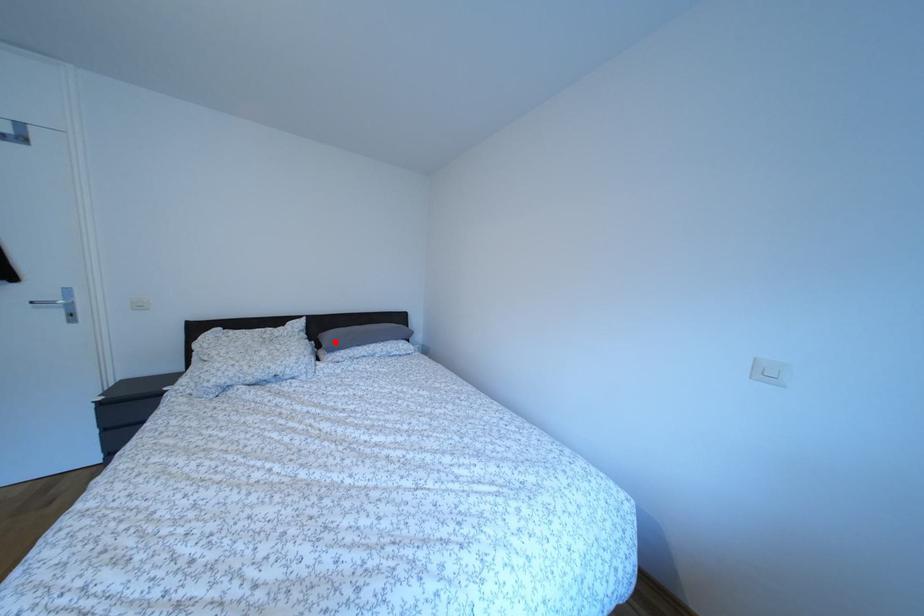
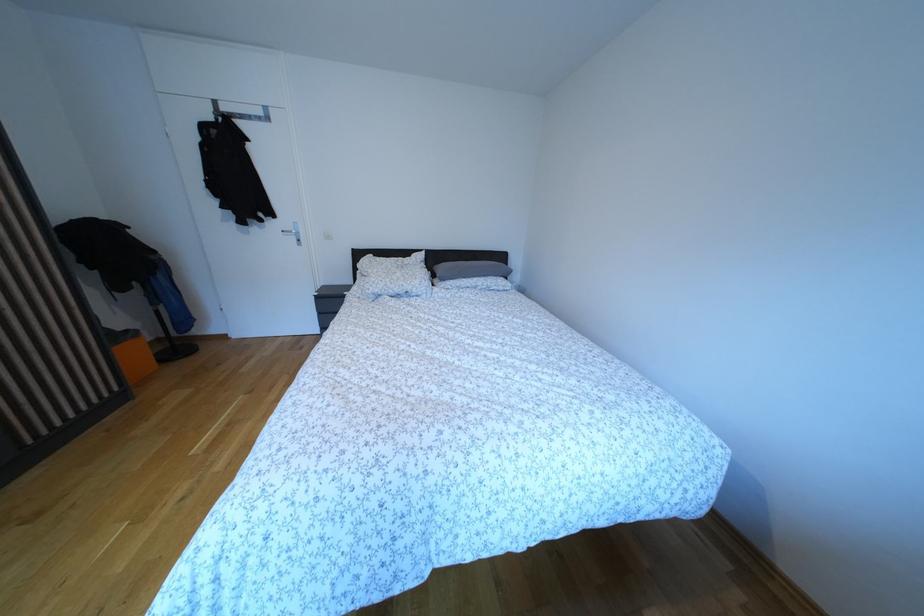
Find the pixel in the second image that matches the highlighted location in the first image.

(447, 274)